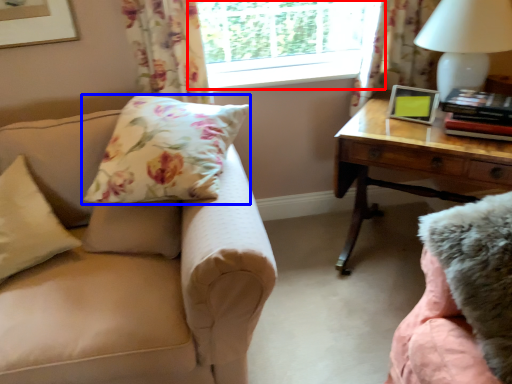
Question: Among these objects, which one is farthest to the camera, window (highlighted by a red box) or pillow (highlighted by a blue box)?

Choices:
 (A) window
 (B) pillow

Answer: (A)